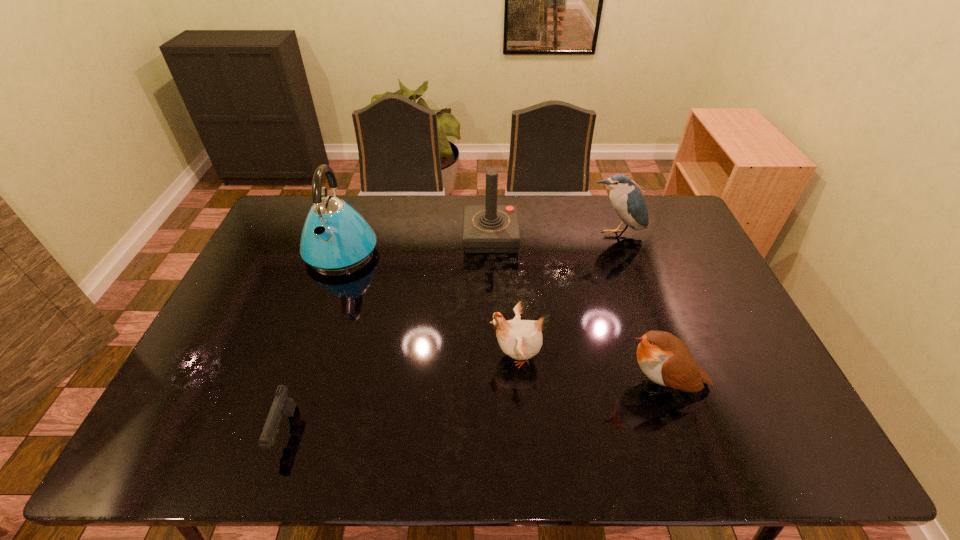
Where is `vacant space situated at the beak of the leftmost bird`? The image size is (960, 540). vacant space situated at the beak of the leftmost bird is located at coordinates (379, 355).

I want to click on free space located at the beak of the leftmost bird, so click(410, 355).

Identify the location of blank space located 0.050m at the beak of the leftmost bird. (470, 355).

The width and height of the screenshot is (960, 540). What are the coordinates of `kettle positioned at the far edge` in the screenshot? It's located at (335, 238).

Identify the location of joystick located at the far edge. Image resolution: width=960 pixels, height=540 pixels. (490, 228).

Identify the location of bird present at the far edge. (627, 200).

The width and height of the screenshot is (960, 540). What are the coordinates of `object located at the near edge` in the screenshot? It's located at (282, 404).

Where is `object that is at the left edge`? The width and height of the screenshot is (960, 540). object that is at the left edge is located at coordinates (335, 238).

Image resolution: width=960 pixels, height=540 pixels. Identify the location of object positioned at the right edge. (666, 360).

I want to click on object situated at the far left corner, so click(x=335, y=238).